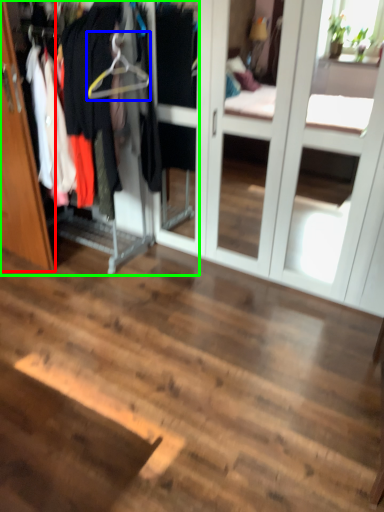
Question: Which object is positioned farthest from door (highlighted by a red box)? Select from hanger (highlighted by a blue box) and closet (highlighted by a green box).

Choices:
 (A) hanger
 (B) closet

Answer: (A)